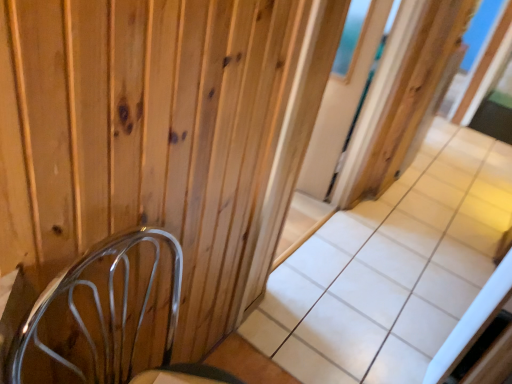
What do you see at coordinates (391, 269) in the screenshot? I see `white tile floor at center` at bounding box center [391, 269].

Identify the location of white tile floor at center. This screenshot has width=512, height=384. (391, 269).

What are the coordinates of `white tile floor at center` in the screenshot? It's located at (391, 269).